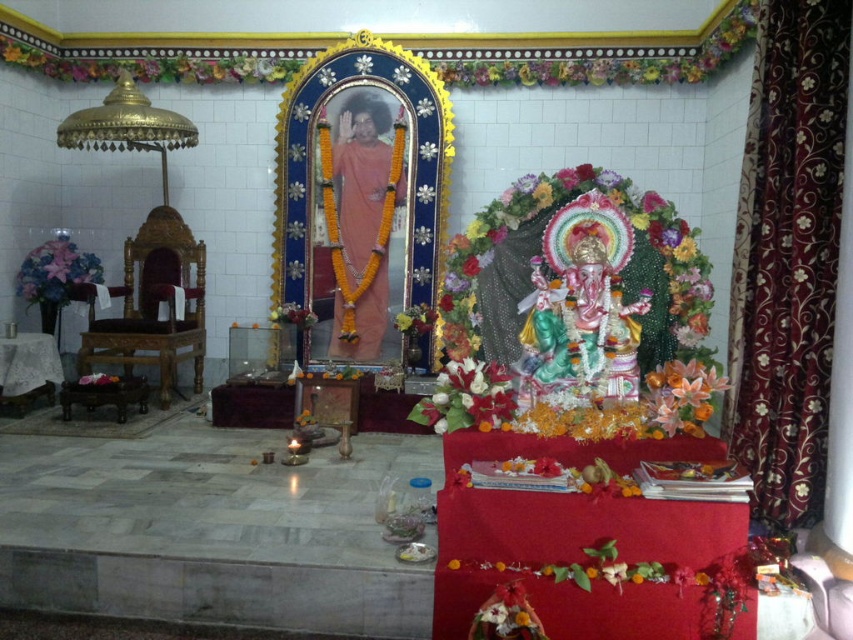
Does floral garland at center have a lesser width compared to orange silk flower at lower right?

In fact, floral garland at center might be wider than orange silk flower at lower right.

Can you confirm if floral garland at center is wider than orange silk flower at lower right?

Correct, the width of floral garland at center exceeds that of orange silk flower at lower right.

Between point (480, 348) and point (689, 412), which one is positioned in front?

Positioned in front is point (689, 412).

The image size is (853, 640). What are the coordinates of `floral garland at center` in the screenshot? It's located at (540, 253).

Consider the image. Is floral garland at center to the right of silky purple fabric at left from the viewer's perspective?

Indeed, floral garland at center is positioned on the right side of silky purple fabric at left.

Between floral garland at center and silky purple fabric at left, which one is positioned higher?

Positioned higher is silky purple fabric at left.

The height and width of the screenshot is (640, 853). I want to click on floral garland at center, so click(x=540, y=253).

How far apart are matte pink statue at center and floral bouquet at center?

matte pink statue at center and floral bouquet at center are 7.70 feet apart.

Does matte pink statue at center have a lesser width compared to floral bouquet at center?

No.

The image size is (853, 640). What do you see at coordinates (360, 218) in the screenshot?
I see `matte pink statue at center` at bounding box center [360, 218].

Locate an element on the screen. The height and width of the screenshot is (640, 853). matte pink statue at center is located at coordinates coord(360,218).